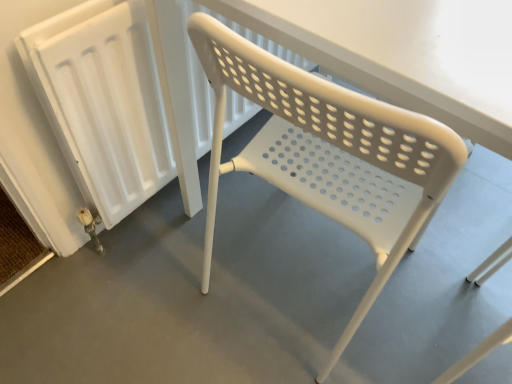
Question: From the image's perspective, is white plastic chair at center positioned above or below white plastic chair at center?

Choices:
 (A) below
 (B) above

Answer: (B)

Question: Looking at the image, does white plastic chair at center seem bigger or smaller compared to white plastic chair at center?

Choices:
 (A) big
 (B) small

Answer: (A)

Question: Which object is the closest to the white plastic chair at center?

Choices:
 (A) white plastic radiator at left
 (B) white plastic chair at center

Answer: (B)

Question: Which of these objects is positioned farthest from the white plastic radiator at left?

Choices:
 (A) white plastic chair at center
 (B) white plastic chair at center

Answer: (B)